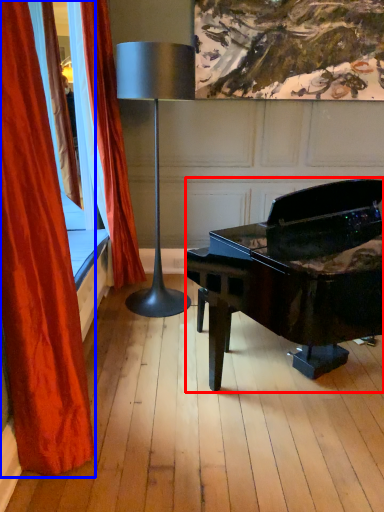
Question: Which object appears farthest to the camera in this image, piano (highlighted by a red box) or curtain (highlighted by a blue box)?

Choices:
 (A) piano
 (B) curtain

Answer: (B)